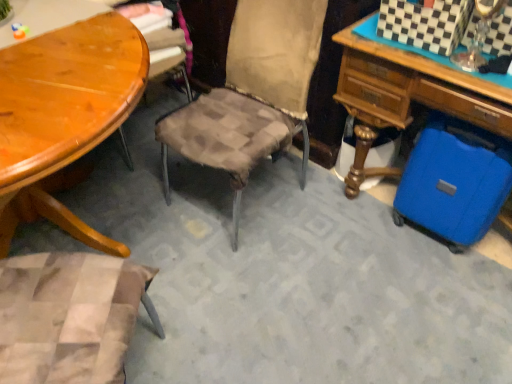
Measure the distance between blue hardshell suitcase at lower right and camera.

1.34 meters.

Identify the location of shiny wood table at left. (64, 115).

Find the location of a particular element. blue hard plastic suitcase at lower right is located at coordinates (408, 96).

Locate an element on the screen. luggage on the left of blue hard plastic suitcase at lower right is located at coordinates (454, 181).

Relative to blue hardshell suitcase at lower right, is blue hard plastic suitcase at lower right in front or behind?

blue hard plastic suitcase at lower right is positioned closer to the viewer than blue hardshell suitcase at lower right.

Considering the sizes of objects blue hard plastic suitcase at lower right and blue hardshell suitcase at lower right in the image provided, who is smaller, blue hard plastic suitcase at lower right or blue hardshell suitcase at lower right?

blue hardshell suitcase at lower right is smaller.

Does blue hard plastic suitcase at lower right have a lesser width compared to blue hardshell suitcase at lower right?

No, blue hard plastic suitcase at lower right is not thinner than blue hardshell suitcase at lower right.

Between blue hardshell suitcase at lower right and shiny wood table at left, which one appears on the right side from the viewer's perspective?

blue hardshell suitcase at lower right is more to the right.

Considering the relative sizes of blue hardshell suitcase at lower right and shiny wood table at left in the image provided, is blue hardshell suitcase at lower right smaller than shiny wood table at left?

Yes, blue hardshell suitcase at lower right is smaller than shiny wood table at left.

Can you tell me how much blue hardshell suitcase at lower right and shiny wood table at left differ in facing direction?

There is a 112-degree angle between the facing directions of blue hardshell suitcase at lower right and shiny wood table at left.

Is blue hardshell suitcase at lower right further to camera compared to shiny wood table at left?

Yes, the depth of blue hardshell suitcase at lower right is greater than that of shiny wood table at left.

Which object is positioned more to the right, blue hard plastic suitcase at lower right or shiny wood table at left?

Positioned to the right is blue hard plastic suitcase at lower right.

From a real-world perspective, who is located higher, blue hard plastic suitcase at lower right or shiny wood table at left?

shiny wood table at left.

Considering the relative sizes of blue hard plastic suitcase at lower right and shiny wood table at left in the image provided, is blue hard plastic suitcase at lower right taller than shiny wood table at left?

In fact, blue hard plastic suitcase at lower right may be shorter than shiny wood table at left.

Is point (354, 90) closer to viewer compared to point (95, 120)?

That is False.

Is shiny wood table at left touching blue hardshell suitcase at lower right?

There is a gap between shiny wood table at left and blue hardshell suitcase at lower right.

Is shiny wood table at left to the left of blue hardshell suitcase at lower right from the viewer's perspective?

Yes.

Looking at their sizes, would you say shiny wood table at left is wider or thinner than blue hardshell suitcase at lower right?

Considering their sizes, shiny wood table at left looks broader than blue hardshell suitcase at lower right.

From a real-world perspective, is shiny wood table at left positioned above or below blue hardshell suitcase at lower right?

In terms of real-world spatial position, shiny wood table at left is above blue hardshell suitcase at lower right.

Does blue hardshell suitcase at lower right contain blue hard plastic suitcase at lower right?

No, blue hard plastic suitcase at lower right is not a part of blue hardshell suitcase at lower right.

Who is smaller, blue hardshell suitcase at lower right or blue hard plastic suitcase at lower right?

blue hardshell suitcase at lower right.

Which of these two, blue hardshell suitcase at lower right or blue hard plastic suitcase at lower right, stands shorter?

blue hardshell suitcase at lower right is shorter.

This screenshot has width=512, height=384. Find the location of `luggage below the blue hard plastic suitcase at lower right (from the image's perspective)`. luggage below the blue hard plastic suitcase at lower right (from the image's perspective) is located at coordinates (454, 181).

Between shiny wood table at left and blue hard plastic suitcase at lower right, which one has smaller size?

Smaller between the two is shiny wood table at left.

Is shiny wood table at left inside the boundaries of blue hard plastic suitcase at lower right, or outside?

shiny wood table at left is spatially situated outside blue hard plastic suitcase at lower right.

From the image's perspective, which one is positioned lower, shiny wood table at left or blue hard plastic suitcase at lower right?

shiny wood table at left is shown below in the image.

Is shiny wood table at left facing towards blue hard plastic suitcase at lower right?

No, shiny wood table at left is not turned towards blue hard plastic suitcase at lower right.

Where is `desk on the right of the blue hardshell suitcase at lower right`? This screenshot has height=384, width=512. desk on the right of the blue hardshell suitcase at lower right is located at coordinates (408, 96).

Where is `luggage below the shiny wood table at left (from a real-world perspective)`? luggage below the shiny wood table at left (from a real-world perspective) is located at coordinates (454, 181).

When comparing their distances from shiny wood table at left, does blue hardshell suitcase at lower right or blue hard plastic suitcase at lower right seem closer?

Among the two, blue hard plastic suitcase at lower right is located nearer to shiny wood table at left.

When comparing their distances from blue hard plastic suitcase at lower right, does blue hardshell suitcase at lower right or shiny wood table at left seem further?

shiny wood table at left lies further to blue hard plastic suitcase at lower right than the other object.

From the image, which object appears to be farther from blue hard plastic suitcase at lower right, shiny wood table at left or blue hardshell suitcase at lower right?

shiny wood table at left is further to blue hard plastic suitcase at lower right.

Looking at the image, which one is located closer to blue hardshell suitcase at lower right, shiny wood table at left or blue hard plastic suitcase at lower right?

Based on the image, blue hard plastic suitcase at lower right appears to be nearer to blue hardshell suitcase at lower right.

From the image, which object appears to be farther from shiny wood table at left, blue hard plastic suitcase at lower right or blue hardshell suitcase at lower right?

blue hardshell suitcase at lower right is positioned further to the anchor shiny wood table at left.

Based on the photo, when comparing their distances from blue hardshell suitcase at lower right, does blue hard plastic suitcase at lower right or shiny wood table at left seem further?

Among the two, shiny wood table at left is located further to blue hardshell suitcase at lower right.

The height and width of the screenshot is (384, 512). What are the coordinates of `luggage situated between shiny wood table at left and blue hard plastic suitcase at lower right from left to right` in the screenshot? It's located at (454, 181).